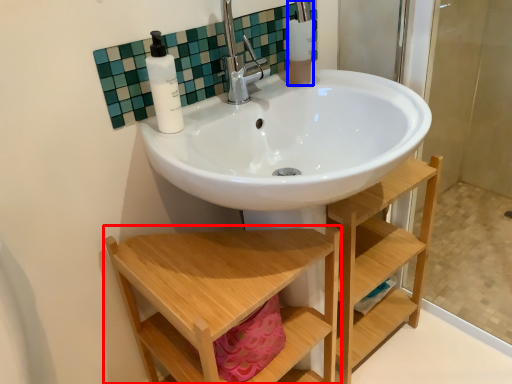
Question: Which object is closer to the camera taking this photo, furniture (highlighted by a red box) or toiletry (highlighted by a blue box)?

Choices:
 (A) furniture
 (B) toiletry

Answer: (A)